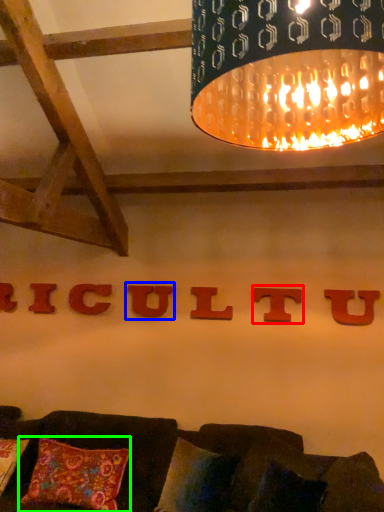
Question: Which object is positioned farthest from alphabet (highlighted by a red box)? Select from alphabet (highlighted by a blue box) and pillow (highlighted by a green box).

Choices:
 (A) alphabet
 (B) pillow

Answer: (B)